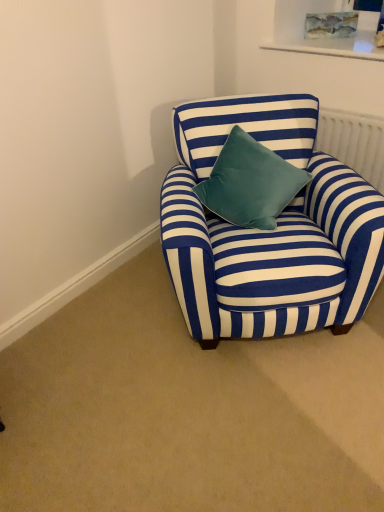
Question: Considering the relative sizes of blue striped fabric armchair at center and velvet teal pillow at center in the image provided, is blue striped fabric armchair at center wider than velvet teal pillow at center?

Choices:
 (A) no
 (B) yes

Answer: (B)

Question: Is blue striped fabric armchair at center facing towards velvet teal pillow at center?

Choices:
 (A) yes
 (B) no

Answer: (A)

Question: Is blue striped fabric armchair at center next to velvet teal pillow at center?

Choices:
 (A) yes
 (B) no

Answer: (B)

Question: Can you confirm if blue striped fabric armchair at center is bigger than velvet teal pillow at center?

Choices:
 (A) no
 (B) yes

Answer: (B)

Question: Is blue striped fabric armchair at center looking in the opposite direction of velvet teal pillow at center?

Choices:
 (A) no
 (B) yes

Answer: (B)

Question: Is point (334, 145) closer or farther from the camera than point (281, 180)?

Choices:
 (A) farther
 (B) closer

Answer: (A)

Question: Based on their sizes in the image, would you say white textured radiator at upper right is bigger or smaller than velvet teal pillow at center?

Choices:
 (A) small
 (B) big

Answer: (A)

Question: From a real-world perspective, is white textured radiator at upper right physically located above or below velvet teal pillow at center?

Choices:
 (A) above
 (B) below

Answer: (B)

Question: Relative to velvet teal pillow at center, is white textured radiator at upper right in front or behind?

Choices:
 (A) behind
 (B) front

Answer: (A)

Question: Is white textured radiator at upper right in front of or behind blue striped fabric armchair at center in the image?

Choices:
 (A) behind
 (B) front

Answer: (A)

Question: Is white textured radiator at upper right inside the boundaries of blue striped fabric armchair at center, or outside?

Choices:
 (A) inside
 (B) outside

Answer: (B)

Question: In terms of width, does white textured radiator at upper right look wider or thinner when compared to blue striped fabric armchair at center?

Choices:
 (A) wide
 (B) thin

Answer: (B)

Question: From a real-world perspective, relative to blue striped fabric armchair at center, is white textured radiator at upper right vertically above or below?

Choices:
 (A) below
 (B) above

Answer: (B)

Question: Is blue striped fabric armchair at center inside the boundaries of velvet teal pillow at center, or outside?

Choices:
 (A) outside
 (B) inside

Answer: (A)

Question: Is blue striped fabric armchair at center bigger or smaller than velvet teal pillow at center?

Choices:
 (A) big
 (B) small

Answer: (A)